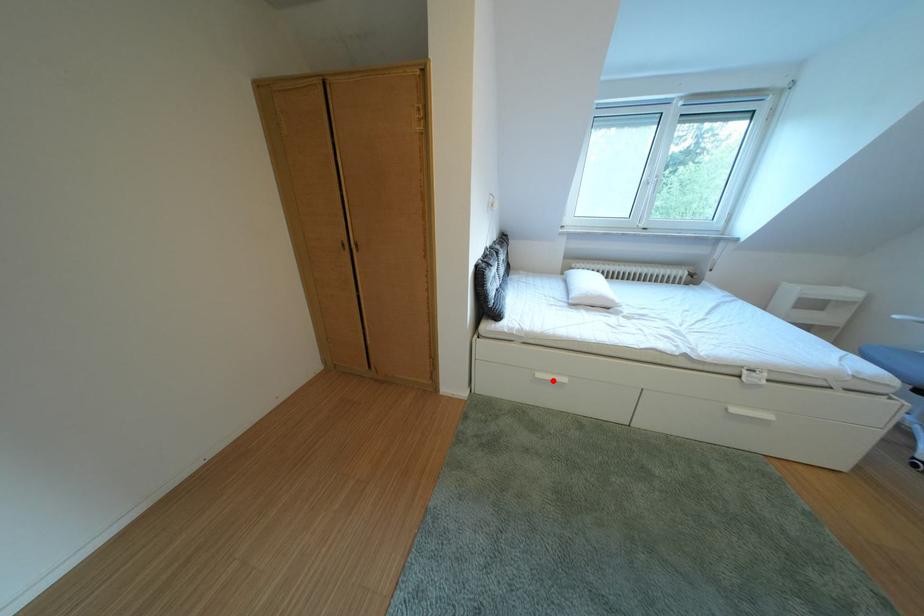
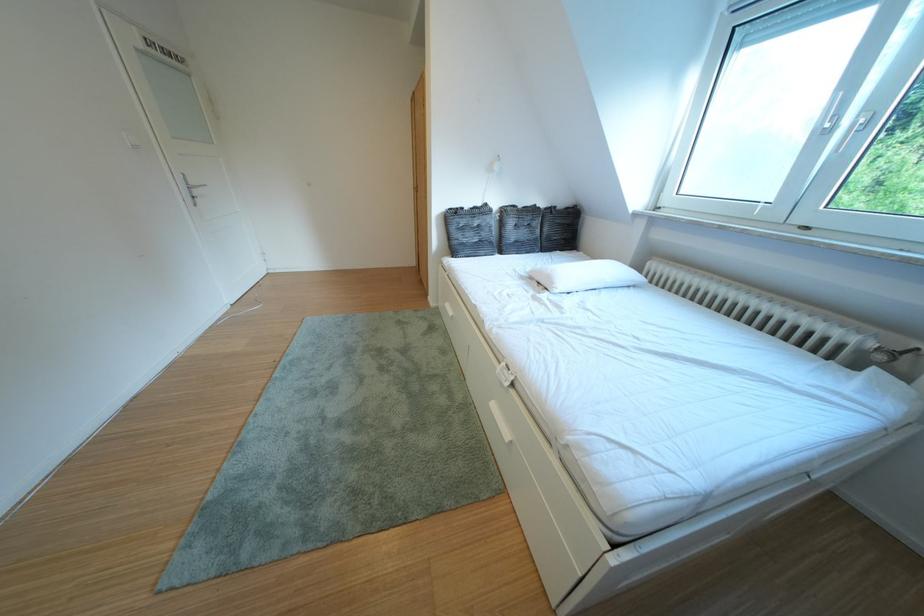
The point at the highlighted location is marked in the first image. Where is the corresponding point in the second image?

(460, 310)